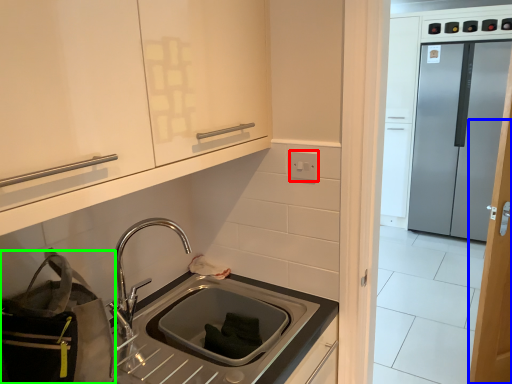
Question: Which object is positioned farthest from electric outlet (highlighted by a red box)? Select from door (highlighted by a blue box) and bag (highlighted by a green box).

Choices:
 (A) door
 (B) bag

Answer: (A)